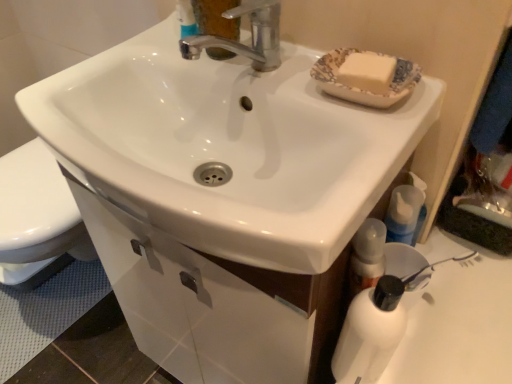
What do you see at coordinates (228, 147) in the screenshot? I see `white glossy sink at center` at bounding box center [228, 147].

In order to face white glossy drawer at lower center, should I rotate leftwards or rightwards?

Turn left by 12.232 degrees to look at white glossy drawer at lower center.

At what (x,y) coordinates should I click in order to perform the action: click on white glossy sink at center. Please return your answer as a coordinate pair (x, y). Looking at the image, I should click on (228, 147).

Where is `drawer behind the blue translucent bottle at lower right`? The height and width of the screenshot is (384, 512). drawer behind the blue translucent bottle at lower right is located at coordinates (195, 304).

Based on the photo, considering the sizes of objects white glossy drawer at lower center and blue translucent bottle at lower right in the image provided, who is bigger, white glossy drawer at lower center or blue translucent bottle at lower right?

Bigger between the two is white glossy drawer at lower center.

Can you tell me how much white glossy drawer at lower center and blue translucent bottle at lower right differ in facing direction?

They differ by 1.09 degrees in their facing directions.

Is white matte bottle at lower right facing towards blue translucent bottle at lower right?

No, white matte bottle at lower right is not aimed at blue translucent bottle at lower right.

From a real-world perspective, is white matte bottle at lower right under blue translucent bottle at lower right?

Incorrect, from a real-world perspective, white matte bottle at lower right is higher than blue translucent bottle at lower right.

Between white matte bottle at lower right and blue translucent bottle at lower right, which one appears on the right side from the viewer's perspective?

blue translucent bottle at lower right is more to the right.

Does point (395, 303) come closer to viewer compared to point (401, 210)?

That is True.

Where is `sink above the white glossy drawer at lower center (from a real-world perspective)`? Image resolution: width=512 pixels, height=384 pixels. sink above the white glossy drawer at lower center (from a real-world perspective) is located at coordinates (228, 147).

From the image's perspective, is white glossy sink at center on top of white glossy drawer at lower center?

Yes, from the image's perspective, white glossy sink at center is above white glossy drawer at lower center.

Between white glossy sink at center and white glossy drawer at lower center, which one has larger size?

white glossy sink at center is bigger.

In the image, is white glossy sink at center positioned in front of or behind white glossy drawer at lower center?

In the image, white glossy sink at center appears in front of white glossy drawer at lower center.

Is blue translucent bottle at lower right facing away from white matte bottle at lower right?

No, blue translucent bottle at lower right's orientation is not away from white matte bottle at lower right.

Visually, is blue translucent bottle at lower right positioned to the left or to the right of white matte bottle at lower right?

From the image, it's evident that blue translucent bottle at lower right is to the right of white matte bottle at lower right.

Is blue translucent bottle at lower right bigger than white matte bottle at lower right?

No.

From the image's perspective, does blue translucent bottle at lower right appear higher than white matte bottle at lower right?

Yes, from the image's perspective, blue translucent bottle at lower right is on top of white matte bottle at lower right.

Is white matte bottle at lower right wider or thinner than white glossy drawer at lower center?

In the image, white matte bottle at lower right appears to be more narrow than white glossy drawer at lower center.

From a real-world perspective, which object rests below the other?

white glossy drawer at lower center.

Is white matte bottle at lower right far from white glossy drawer at lower center?

No, white matte bottle at lower right is not far away from white glossy drawer at lower center.

Based on the photo, could white glossy drawer at lower center be considered to be inside white matte bottle at lower right?

Definitely not — white glossy drawer at lower center is not inside white matte bottle at lower right.

From the image's perspective, is white matte bottle at lower right above white glossy sink at center?

Actually, white matte bottle at lower right appears below white glossy sink at center in the image.

Is white matte bottle at lower right bigger or smaller than white glossy sink at center?

Considering their sizes, white matte bottle at lower right takes up less space than white glossy sink at center.

Considering the positions of point (344, 365) and point (139, 43), is point (344, 365) closer or farther from the camera than point (139, 43)?

Point (344, 365).

Is white matte bottle at lower right in front of or behind white glossy sink at center in the image?

white matte bottle at lower right is behind white glossy sink at center.

Looking at this image, is the surface of white glossy drawer at lower center in direct contact with white matte bottle at lower right?

No.

Between white glossy drawer at lower center and white matte bottle at lower right, which one appears on the right side from the viewer's perspective?

From the viewer's perspective, white matte bottle at lower right appears more on the right side.

Considering the relative sizes of white glossy drawer at lower center and white matte bottle at lower right in the image provided, is white glossy drawer at lower center wider than white matte bottle at lower right?

Correct, the width of white glossy drawer at lower center exceeds that of white matte bottle at lower right.

You are a GUI agent. You are given a task and a screenshot of the screen. Output one action in this format:
    pyautogui.click(x=<x>, y=<y>)
    Task: Click on the drawer on the left of blue translucent bottle at lower right
    This screenshot has width=512, height=384.
    Given the screenshot: What is the action you would take?
    pyautogui.click(x=195, y=304)

The image size is (512, 384). Identify the location of bottle above the blue translucent bottle at lower right (from a real-world perspective). point(370,332).

From the image, which object appears to be nearer to white matte bottle at lower right, white glossy drawer at lower center or white glossy sink at center?

white glossy drawer at lower center lies closer to white matte bottle at lower right than the other object.

Which object lies nearer to the anchor point white glossy drawer at lower center, white glossy sink at center or white matte bottle at lower right?

white glossy sink at center.

Looking at the image, which one is located closer to white glossy drawer at lower center, blue translucent bottle at lower right or white matte bottle at lower right?

white matte bottle at lower right lies closer to white glossy drawer at lower center than the other object.

From the image, which object appears to be farther from white glossy sink at center, white glossy drawer at lower center or white matte bottle at lower right?

Based on the image, white matte bottle at lower right appears to be further to white glossy sink at center.

Based on their spatial positions, is white matte bottle at lower right or white glossy sink at center closer to white glossy drawer at lower center?

white glossy sink at center is closer to white glossy drawer at lower center.

Which object lies nearer to the anchor point white glossy sink at center, blue translucent bottle at lower right or white glossy drawer at lower center?

white glossy drawer at lower center.

When comparing their distances from blue translucent bottle at lower right, does white glossy drawer at lower center or white glossy sink at center seem further?

Among the two, white glossy drawer at lower center is located further to blue translucent bottle at lower right.

Estimate the real-world distances between objects in this image. Which object is closer to blue translucent bottle at lower right, white glossy drawer at lower center or white matte bottle at lower right?

white matte bottle at lower right.

Locate an element on the screen. This screenshot has height=384, width=512. bottle that lies between white glossy sink at center and white glossy drawer at lower center from top to bottom is located at coordinates (370, 332).

At what (x,y) coordinates should I click in order to perform the action: click on mouthwash that lies between white glossy sink at center and white glossy drawer at lower center from top to bottom. Please return your answer as a coordinate pair (x, y). Looking at the image, I should click on (403, 213).

I want to click on bottle between white glossy sink at center and blue translucent bottle at lower right from front to back, so click(x=370, y=332).

At what (x,y) coordinates should I click in order to perform the action: click on bottle situated between white glossy drawer at lower center and blue translucent bottle at lower right from left to right. Please return your answer as a coordinate pair (x, y). The height and width of the screenshot is (384, 512). Looking at the image, I should click on (370, 332).